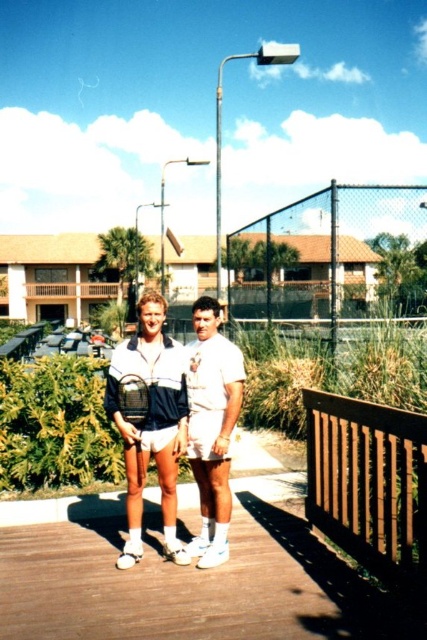
What do you see at coordinates (211, 426) in the screenshot? The height and width of the screenshot is (640, 427). I see `white matte shorts at center` at bounding box center [211, 426].

Can you confirm if white matte shorts at center is wider than black mesh racket at center?

Yes.

Locate an element on the screen. Image resolution: width=427 pixels, height=640 pixels. white matte shorts at center is located at coordinates (211, 426).

This screenshot has width=427, height=640. I want to click on white matte shorts at center, so click(x=211, y=426).

Can you confirm if white cotton shorts at center is thinner than white matte shorts at center?

Incorrect, white cotton shorts at center's width is not less than white matte shorts at center's.

Which is more to the left, white cotton shorts at center or white matte shorts at center?

white cotton shorts at center

Which is in front, point (148, 387) or point (225, 396)?

Point (148, 387)

This screenshot has height=640, width=427. In order to click on white cotton shorts at center in this screenshot , I will do `click(149, 420)`.

Between white cotton shorts at center and black mesh racket at center, which one appears on the right side from the viewer's perspective?

white cotton shorts at center

This screenshot has width=427, height=640. I want to click on white cotton shorts at center, so click(x=149, y=420).